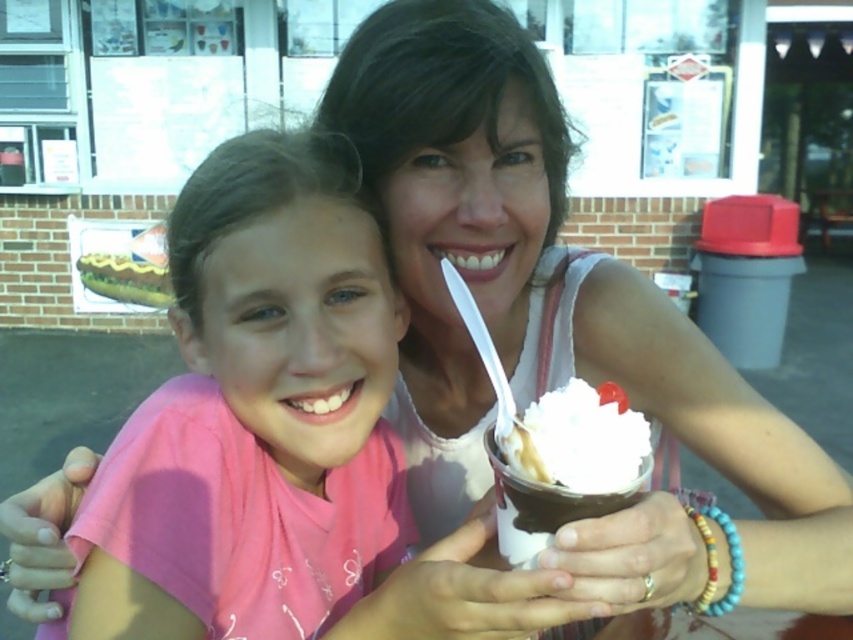
Question: Which point is farther to the camera?

Choices:
 (A) (558, 465)
 (B) (78, 620)

Answer: (B)

Question: Does pink fabric shirt at center lie behind white creamy ice cream at center?

Choices:
 (A) no
 (B) yes

Answer: (B)

Question: Can you confirm if pink fabric shirt at center is smaller than white creamy ice cream at center?

Choices:
 (A) yes
 (B) no

Answer: (B)

Question: Is pink fabric shirt at center thinner than white creamy ice cream at center?

Choices:
 (A) no
 (B) yes

Answer: (A)

Question: Which object appears farthest from the camera in this image?

Choices:
 (A) white creamy ice cream at center
 (B) pink fabric shirt at center

Answer: (B)